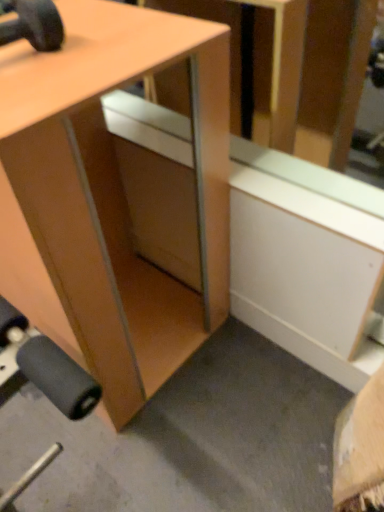
Where is `vacant space in front of matte black dumbbell at upper left`? This screenshot has height=512, width=384. vacant space in front of matte black dumbbell at upper left is located at coordinates (26, 92).